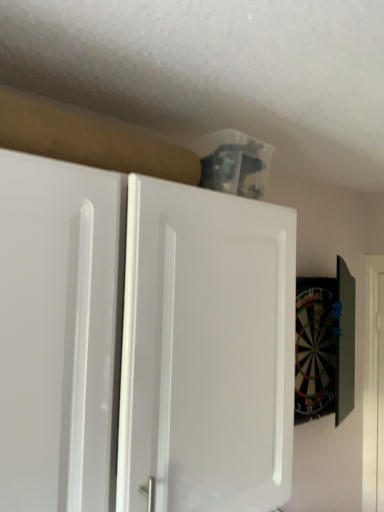
Image resolution: width=384 pixels, height=512 pixels. What do you see at coordinates (374, 388) in the screenshot?
I see `white smooth door at right` at bounding box center [374, 388].

Locate an element on the screen. The height and width of the screenshot is (512, 384). white smooth door at right is located at coordinates (374, 388).

In order to face white smooth door at right, should I rotate leftwards or rightwards?

To face it directly, rotate right by 24.118 degrees.

I want to click on white matte cabinet at upper center, so click(x=142, y=343).

In the scene shown: Measure the distance between point (112, 218) and camera.

Point (112, 218) and camera are 28.50 inches apart.

Describe the element at coordinates (142, 343) in the screenshot. I see `white matte cabinet at upper center` at that location.

Find the location of `white smooth door at right`. white smooth door at right is located at coordinates (374, 388).

Is white matte cabinet at upper center at the right side of white smooth door at right?

No, white matte cabinet at upper center is not to the right of white smooth door at right.

Between white matte cabinet at upper center and white smooth door at right, which one is positioned behind?

white smooth door at right is further away from the camera.

Does point (273, 420) appear closer or farther from the camera than point (371, 415)?

Point (273, 420) is closer to the camera than point (371, 415).

From the image's perspective, which object appears higher, white matte cabinet at upper center or white smooth door at right?

white matte cabinet at upper center.

Looking at this image, from a real-world perspective, is white matte cabinet at upper center over white smooth door at right?

Yes, from a real-world perspective, white matte cabinet at upper center is over white smooth door at right

Which of these two, white matte cabinet at upper center or white smooth door at right, is wider?

Wider between the two is white matte cabinet at upper center.

Does white matte cabinet at upper center have a lesser height compared to white smooth door at right?

Correct, white matte cabinet at upper center is not as tall as white smooth door at right.

Looking at this image, can you confirm if white matte cabinet at upper center is bigger than white smooth door at right?

Correct, white matte cabinet at upper center is larger in size than white smooth door at right.

Is white matte cabinet at upper center not inside white smooth door at right?

Yes, white matte cabinet at upper center is located beyond the bounds of white smooth door at right.

Is there a large distance between white matte cabinet at upper center and white smooth door at right?

Yes, white matte cabinet at upper center is far from white smooth door at right.

Is white matte cabinet at upper center positioned with its back to white smooth door at right?

That's not correct — white matte cabinet at upper center is not looking away from white smooth door at right.

Consider the image. How different are the orientations of white matte cabinet at upper center and white smooth door at right in degrees?

The facing directions of white matte cabinet at upper center and white smooth door at right are 89.3 degrees apart.

Measure the distance between white matte cabinet at upper center and white smooth door at right.

white matte cabinet at upper center and white smooth door at right are 1.24 meters apart.

Where is `door located underneath the white matte cabinet at upper center (from a real-world perspective)`? The width and height of the screenshot is (384, 512). door located underneath the white matte cabinet at upper center (from a real-world perspective) is located at coordinates (374, 388).

Is white smooth door at right to the right of white matte cabinet at upper center from the viewer's perspective?

Yes.

Looking at this image, relative to white matte cabinet at upper center, is white smooth door at right in front or behind?

white smooth door at right is behind white matte cabinet at upper center.

Between point (378, 282) and point (23, 450), which one is positioned in front?

Positioned in front is point (23, 450).

From the image's perspective, is white smooth door at right on white matte cabinet at upper center?

No, from the image's perspective, white smooth door at right is not above white matte cabinet at upper center.

From a real-world perspective, is white smooth door at right positioned above or below white matte cabinet at upper center?

From a real-world perspective, white smooth door at right is physically below white matte cabinet at upper center.

Which object is wider, white smooth door at right or white matte cabinet at upper center?

With larger width is white matte cabinet at upper center.

In the scene shown: Does white smooth door at right have a greater height compared to white matte cabinet at upper center?

Result: Yes, white smooth door at right is taller than white matte cabinet at upper center.

Does white smooth door at right have a smaller size compared to white matte cabinet at upper center?

Yes.

Is white smooth door at right surrounding white matte cabinet at upper center?

No.

Would you consider white smooth door at right to be distant from white matte cabinet at upper center?

white smooth door at right is positioned a significant distance from white matte cabinet at upper center.

Consider the image. Is white smooth door at right turned away from white matte cabinet at upper center?

white smooth door at right is not turned away from white matte cabinet at upper center.

What's the angular difference between white smooth door at right and white matte cabinet at upper center's facing directions?

The angular difference between white smooth door at right and white matte cabinet at upper center is 89.3 degrees.

The image size is (384, 512). I want to click on cabinetry that appears on the left of white smooth door at right, so click(x=142, y=343).

The width and height of the screenshot is (384, 512). Find the location of `door below the white matte cabinet at upper center (from the image's perspective)`. door below the white matte cabinet at upper center (from the image's perspective) is located at coordinates (374, 388).

The image size is (384, 512). Find the location of `cabinetry in front of the white smooth door at right`. cabinetry in front of the white smooth door at right is located at coordinates (142, 343).